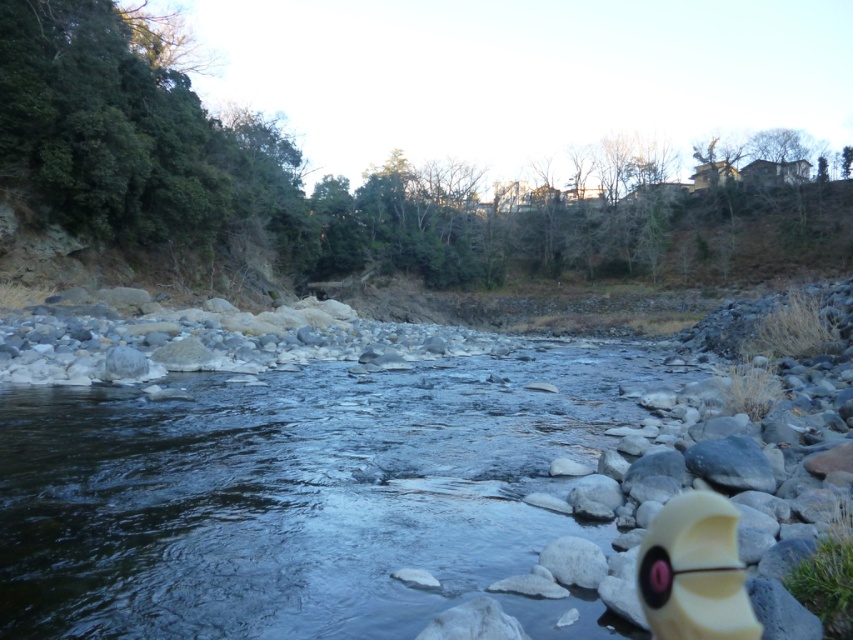
Who is positioned more to the left, smooth stone stream at center or matte yellow toy at lower right?

From the viewer's perspective, smooth stone stream at center appears more on the left side.

Can you confirm if smooth stone stream at center is shorter than matte yellow toy at lower right?

In fact, smooth stone stream at center may be taller than matte yellow toy at lower right.

What do you see at coordinates (294, 492) in the screenshot? I see `smooth stone stream at center` at bounding box center [294, 492].

At what (x,y) coordinates should I click in order to perform the action: click on smooth stone stream at center. Please return your answer as a coordinate pair (x, y). This screenshot has height=640, width=853. Looking at the image, I should click on 294,492.